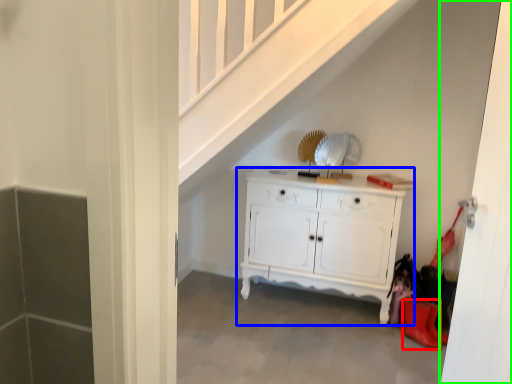
Question: Estimate the real-world distances between objects in this image. Which object is closer to shoe (highlighted by a red box), chest of drawers (highlighted by a blue box) or door (highlighted by a green box)?

Choices:
 (A) chest of drawers
 (B) door

Answer: (A)